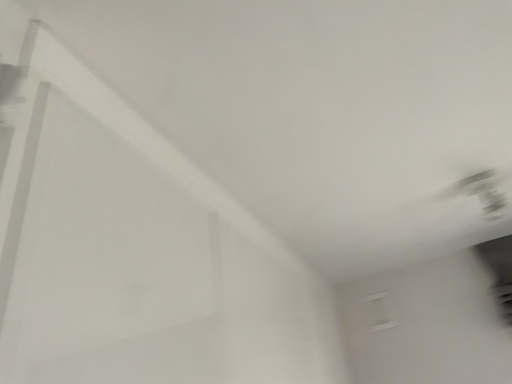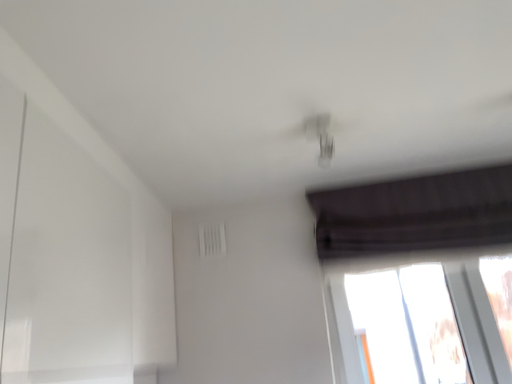
Question: How did the camera likely rotate when shooting the video?

Choices:
 (A) rotated upward
 (B) rotated downward

Answer: (B)